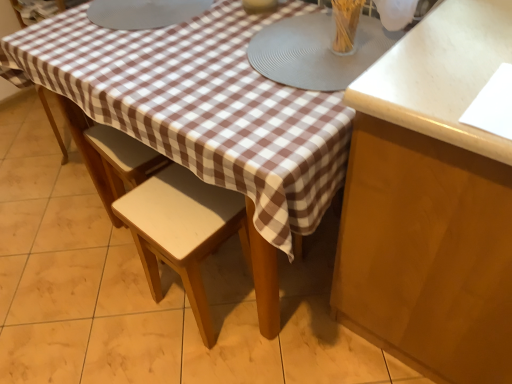
Question: Is point (350, 104) positioned closer to the camera than point (359, 6)?

Choices:
 (A) farther
 (B) closer

Answer: (B)

Question: Considering the positions of matte brown cabinet at right and clear glass vase at upper center in the image, is matte brown cabinet at right bigger or smaller than clear glass vase at upper center?

Choices:
 (A) big
 (B) small

Answer: (A)

Question: Based on their relative distances, which object is farther from the matte gray placemat at center, the second round table from the left?

Choices:
 (A) clear glass vase at upper center
 (B) light beige wood stool at center
 (C) matte brown cabinet at right
 (D) matte gray plate at upper center, which is the second round table from right to left

Answer: (B)

Question: Considering the real-world distances, which object is closest to the light beige wood stool at center?

Choices:
 (A) matte gray placemat at center, the second round table from the left
 (B) matte brown cabinet at right
 (C) clear glass vase at upper center
 (D) matte gray plate at upper center, which is the second round table from right to left

Answer: (B)